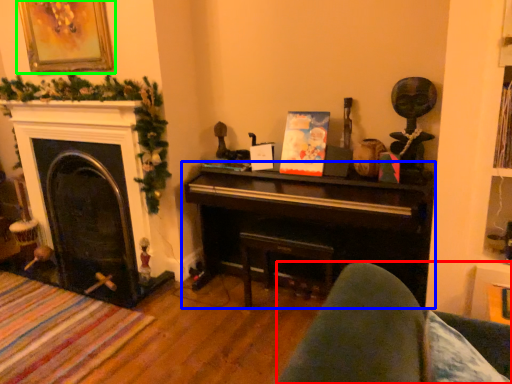
Question: Considering the real-world distances, which object is farthest from rocking chair (highlighted by a red box)? piano (highlighted by a blue box) or picture frame (highlighted by a green box)?

Choices:
 (A) piano
 (B) picture frame

Answer: (B)